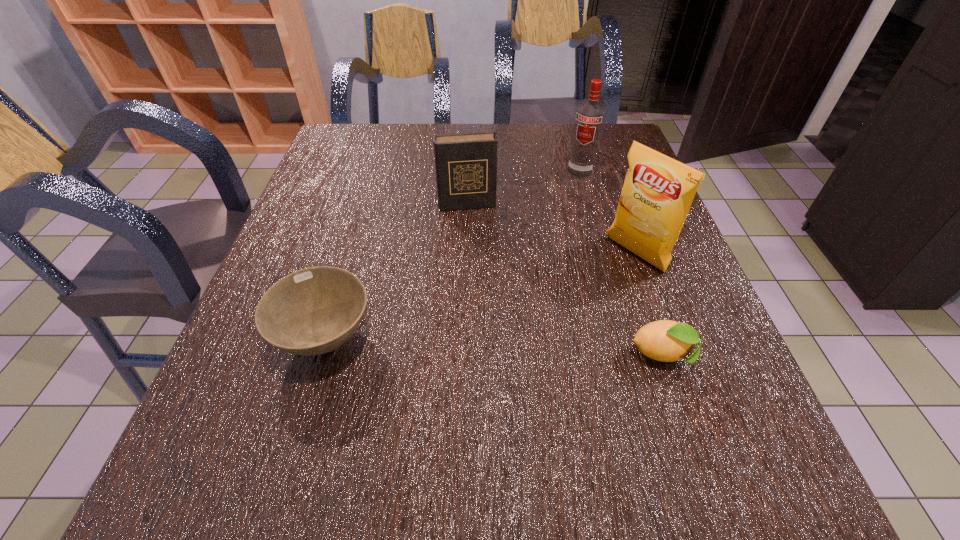
Identify the location of lemon that is at the right edge. The image size is (960, 540). pyautogui.click(x=665, y=340).

This screenshot has height=540, width=960. In order to click on vodka positioned at the right edge in this screenshot , I will do `click(589, 119)`.

This screenshot has height=540, width=960. Identify the location of crisp (potato chip) that is at the right edge. (658, 190).

The image size is (960, 540). In order to click on object that is positioned at the far right corner in this screenshot , I will do `click(589, 119)`.

Where is `vacant space at the far edge`? vacant space at the far edge is located at coordinates (500, 123).

At what (x,y) coordinates should I click in order to perform the action: click on vacant area at the near edge. Please return your answer as a coordinate pair (x, y). The height and width of the screenshot is (540, 960). Looking at the image, I should click on (542, 387).

Where is `free space at the left edge`? This screenshot has width=960, height=540. free space at the left edge is located at coordinates (353, 169).

Image resolution: width=960 pixels, height=540 pixels. What are the coordinates of `vacant region at the right edge of the desktop` in the screenshot? It's located at (684, 275).

Image resolution: width=960 pixels, height=540 pixels. In the image, there is a desktop. What are the coordinates of `vacant space at the far left corner` in the screenshot? It's located at (377, 136).

The height and width of the screenshot is (540, 960). Identify the location of vacant space at the far right corner of the desktop. (570, 125).